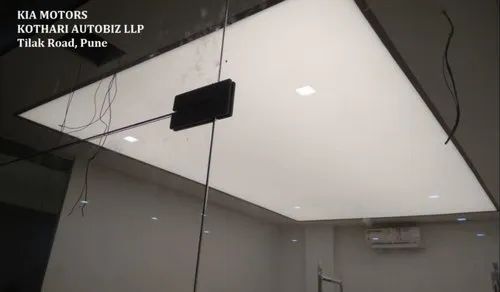
This screenshot has height=292, width=500. I want to click on glass door, so click(x=169, y=212).